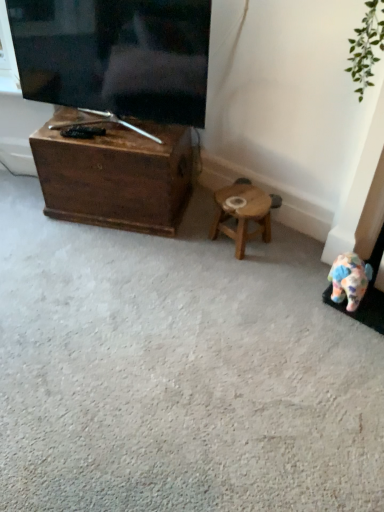
Find the location of a particular element. The width and height of the screenshot is (384, 512). matte black tv at upper left is located at coordinates (115, 55).

Measure the distance between point (233,187) and camera.

Point (233,187) and camera are 2.13 meters apart.

This screenshot has height=512, width=384. What do you see at coordinates (115, 174) in the screenshot?
I see `wooden chest at left` at bounding box center [115, 174].

Image resolution: width=384 pixels, height=512 pixels. What are the coordinates of `matte black tv at upper left` in the screenshot? It's located at (115, 55).

Is wooden chest at left placed right next to matte black tv at upper left?

There is a gap between wooden chest at left and matte black tv at upper left.

Consider the image. Is wooden chest at left smaller than matte black tv at upper left?

Actually, wooden chest at left might be larger than matte black tv at upper left.

Between wooden chest at left and matte black tv at upper left, which one appears on the right side from the viewer's perspective?

Positioned to the right is wooden chest at left.

Can you tell me how much matte black tv at upper left and wooden stool at center differ in facing direction?

The angle between the facing direction of matte black tv at upper left and the facing direction of wooden stool at center is 30.1 degrees.

Would you say matte black tv at upper left is inside or outside wooden stool at center?

matte black tv at upper left is not inside wooden stool at center, it's outside.

Is matte black tv at upper left not near wooden stool at center?

No, matte black tv at upper left is not far from wooden stool at center.

Is point (101, 97) less distant than point (243, 256)?

Yes, it is in front of point (243, 256).

From the image's perspective, relative to matte black tv at upper left, is wooden stool at center above or below?

Clearly, from the image's perspective, wooden stool at center is below matte black tv at upper left.

Can matte black tv at upper left be found inside wooden stool at center?

That's incorrect, matte black tv at upper left is not inside wooden stool at center.

Is wooden stool at center next to matte black tv at upper left?

No, wooden stool at center is not next to matte black tv at upper left.

Can you confirm if wooden stool at center is taller than matte black tv at upper left?

Incorrect, the height of wooden stool at center is not larger of that of matte black tv at upper left.

Which of these two, wooden chest at left or wooden stool at center, stands taller?

wooden chest at left.

Consider the image. Looking at the image, does wooden chest at left seem bigger or smaller compared to wooden stool at center?

In the image, wooden chest at left appears to be larger than wooden stool at center.

From a real-world perspective, which is physically below, wooden chest at left or wooden stool at center?

wooden stool at center is physically lower.

Is wooden chest at left looking in the opposite direction of wooden stool at center?

That's not correct — wooden chest at left is not looking away from wooden stool at center.

Could you tell me if matte black tv at upper left is facing wooden chest at left?

No, matte black tv at upper left is not facing towards wooden chest at left.

Which is behind, matte black tv at upper left or wooden chest at left?

wooden chest at left is more distant.

Which of these two, matte black tv at upper left or wooden chest at left, stands taller?

With more height is matte black tv at upper left.

From the image's perspective, is matte black tv at upper left located above or below wooden chest at left?

Based on their image positions, matte black tv at upper left is located above wooden chest at left.

Between wooden stool at center and wooden chest at left, which one has smaller width?

Thinner between the two is wooden stool at center.

Is wooden stool at center oriented towards wooden chest at left?

No, wooden stool at center is not aimed at wooden chest at left.

Considering the relative positions of wooden stool at center and wooden chest at left in the image provided, is wooden stool at center to the right of wooden chest at left from the viewer's perspective?

Yes.

You are a GUI agent. You are given a task and a screenshot of the screen. Output one action in this format:
    pyautogui.click(x=<x>, y=<y>)
    Task: Click on the television to the left of wooden chest at left
    
    Given the screenshot: What is the action you would take?
    115,55

Where is `television in front of the wooden stool at center`? The image size is (384, 512). television in front of the wooden stool at center is located at coordinates (115, 55).

Considering their positions, is wooden chest at left positioned further to matte black tv at upper left than wooden stool at center?

Based on the image, wooden stool at center appears to be further to matte black tv at upper left.

When comparing their distances from wooden stool at center, does matte black tv at upper left or wooden chest at left seem further?

Based on the image, matte black tv at upper left appears to be further to wooden stool at center.

When comparing their distances from matte black tv at upper left, does wooden stool at center or wooden chest at left seem further?

wooden stool at center is positioned further to the anchor matte black tv at upper left.

Looking at this image, based on their spatial positions, is wooden stool at center or matte black tv at upper left further from wooden chest at left?

wooden stool at center lies further to wooden chest at left than the other object.

Based on their spatial positions, is wooden chest at left or matte black tv at upper left further from wooden stool at center?

Among the two, matte black tv at upper left is located further to wooden stool at center.

Which object lies nearer to the anchor point wooden chest at left, matte black tv at upper left or wooden stool at center?

Among the two, matte black tv at upper left is located nearer to wooden chest at left.

At what (x,y) coordinates should I click in order to perform the action: click on table situated between matte black tv at upper left and wooden stool at center from left to right. Please return your answer as a coordinate pair (x, y). The image size is (384, 512). Looking at the image, I should click on (115, 174).